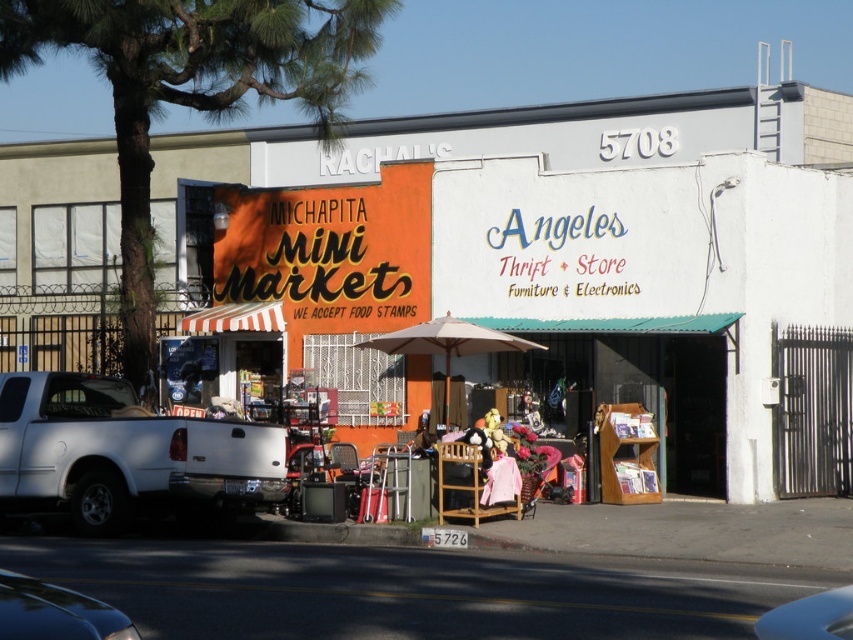
Who is positioned more to the left, shiny black car at lower left or blue glossy car at lower right?

shiny black car at lower left is more to the left.

Which of these two, shiny black car at lower left or blue glossy car at lower right, stands taller?

blue glossy car at lower right is taller.

I want to click on shiny black car at lower left, so click(55, 612).

Is the position of white matte pickup truck at left less distant than that of blue glossy car at lower right?

No, it is behind blue glossy car at lower right.

Where is `white matte pickup truck at left`? white matte pickup truck at left is located at coordinates (123, 451).

Does white matte pickup truck at left have a lesser width compared to shiny black car at lower left?

No.

Is white matte pickup truck at left taller than shiny black car at lower left?

Yes, white matte pickup truck at left is taller than shiny black car at lower left.

Where is `white matte pickup truck at left`? This screenshot has width=853, height=640. white matte pickup truck at left is located at coordinates (123, 451).